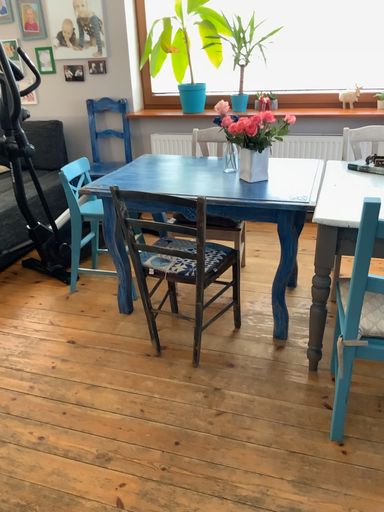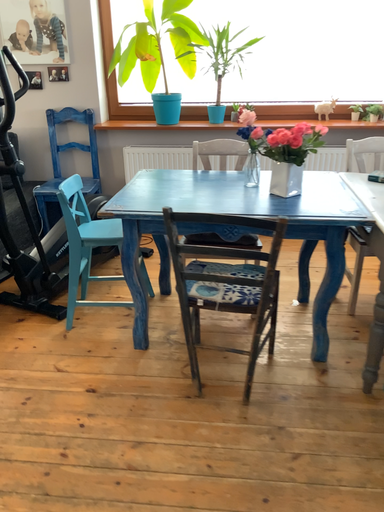
Question: Which way did the camera rotate in the video?

Choices:
 (A) rotated left
 (B) rotated right

Answer: (B)